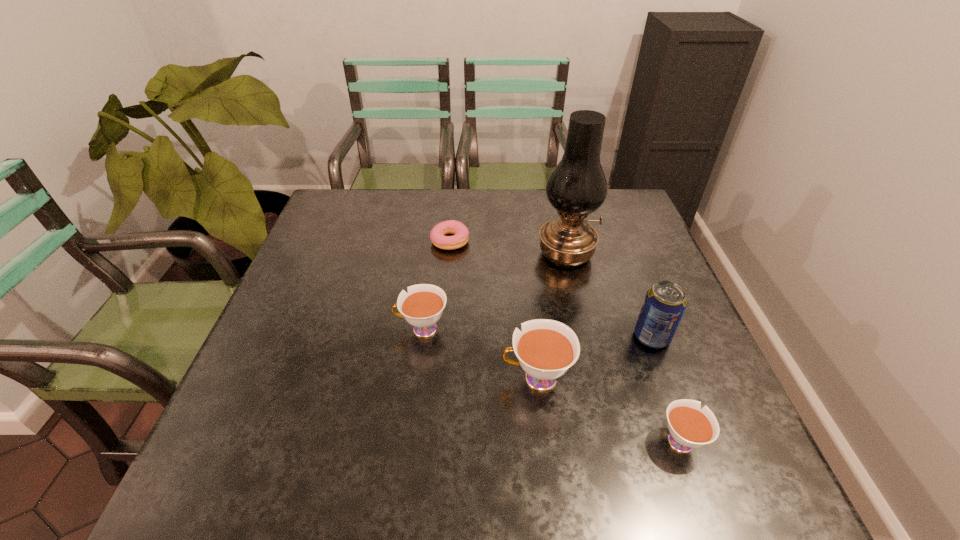
At what (x,y) coordinates should I click in order to perform the action: click on the farthest teacup. Please return your answer as a coordinate pair (x, y). This screenshot has width=960, height=540. Looking at the image, I should click on (422, 307).

Locate an element on the screen. Image resolution: width=960 pixels, height=540 pixels. the fourth tallest object is located at coordinates click(422, 307).

Find the location of a particular element. Image resolution: width=960 pixels, height=540 pixels. the second nearest object is located at coordinates (546, 349).

Find the location of a particular element. the tallest teacup is located at coordinates (546, 349).

Locate an element on the screen. The height and width of the screenshot is (540, 960). the nearest object is located at coordinates (690, 426).

Where is `the nearest teacup`? The image size is (960, 540). the nearest teacup is located at coordinates (690, 426).

I want to click on oil lamp, so click(577, 187).

What are the coordinates of `doughnut` in the screenshot? It's located at (460, 238).

In order to click on the fifth shortest object in this screenshot , I will do `click(665, 303)`.

Identify the location of free region located on the side of the leftmost teacup with the handle. The width and height of the screenshot is (960, 540). (361, 329).